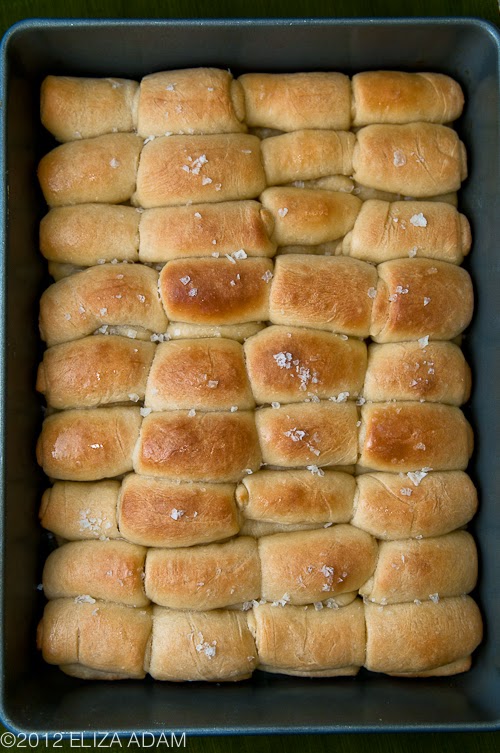
Identify the location of baking pan. (21, 486).